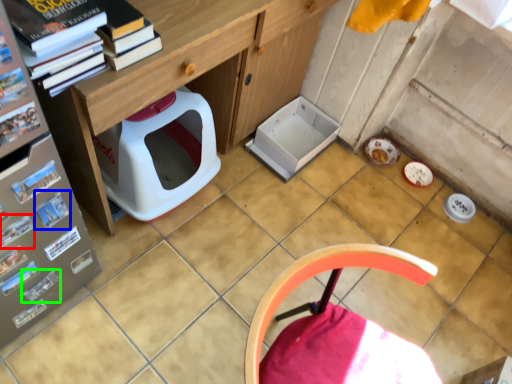
Question: Considering the real-world distances, which object is farthest from magazine (highlighted by a red box)? magazine (highlighted by a blue box) or magazine (highlighted by a green box)?

Choices:
 (A) magazine
 (B) magazine

Answer: (B)